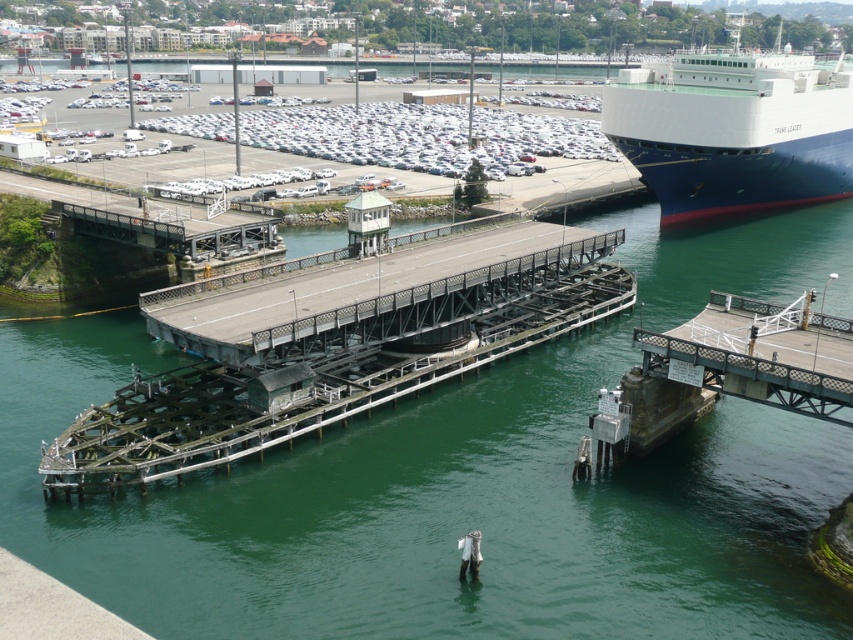
Question: Which of the following is the farthest from the observer?

Choices:
 (A) blue polished steel ship at right
 (B) greenish metallic bridge at center

Answer: (A)

Question: Which point is closer to the camera?

Choices:
 (A) (770, 157)
 (B) (265, 406)

Answer: (B)

Question: Can you confirm if greenish metallic bridge at center is smaller than blue polished steel ship at right?

Choices:
 (A) no
 (B) yes

Answer: (B)

Question: Can you confirm if greenish metallic bridge at center is thinner than blue polished steel ship at right?

Choices:
 (A) yes
 (B) no

Answer: (A)

Question: Does greenish metallic bridge at center have a larger size compared to blue polished steel ship at right?

Choices:
 (A) yes
 (B) no

Answer: (B)